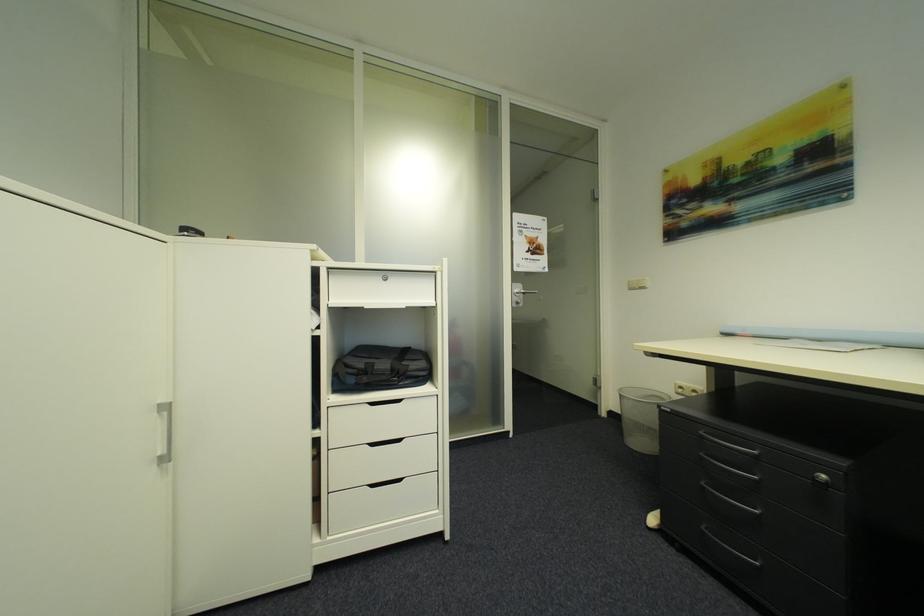
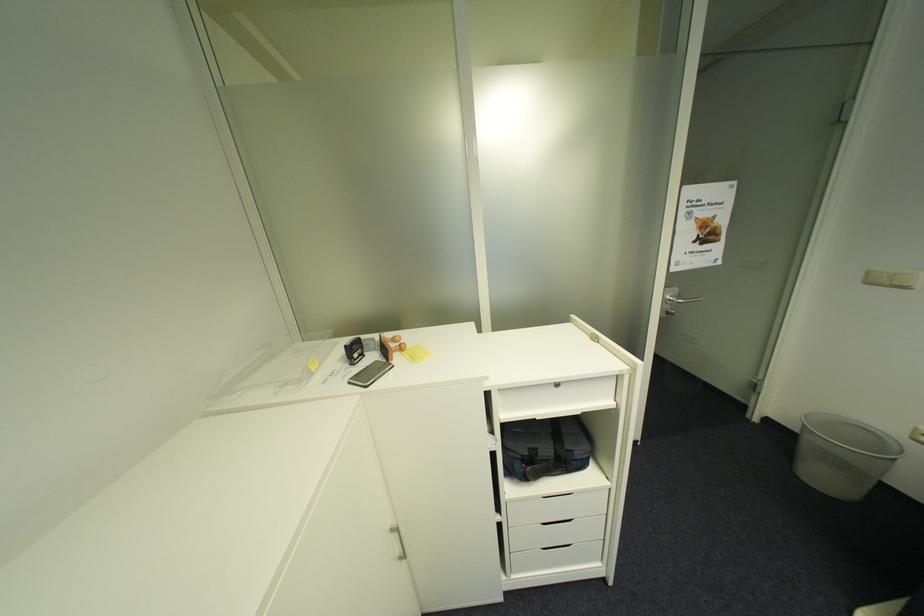
Find the pixel in the second image that matches (x=646, y=288) in the first image.

(895, 285)